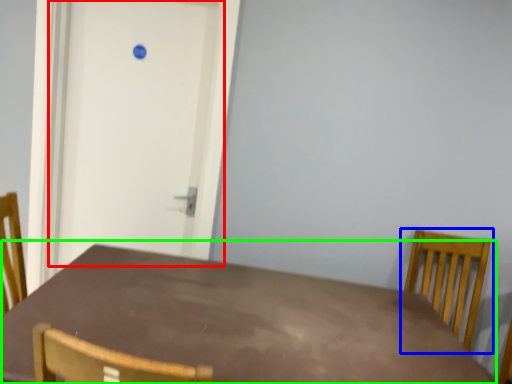
Question: Based on their relative distances, which object is farther from door (highlighted by a red box)? Choose from chair (highlighted by a blue box) and table (highlighted by a green box).

Choices:
 (A) chair
 (B) table

Answer: (A)